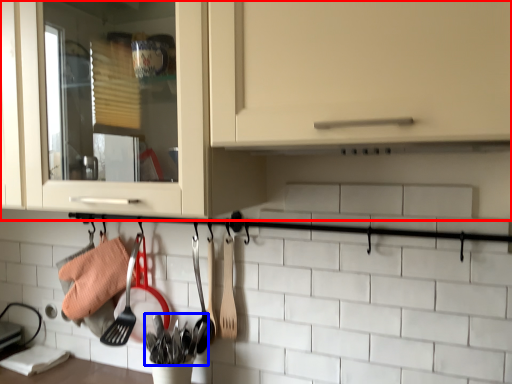
Question: Which point is further to the camera, cabinetry (highlighted by a red box) or silverware (highlighted by a blue box)?

Choices:
 (A) cabinetry
 (B) silverware

Answer: (B)